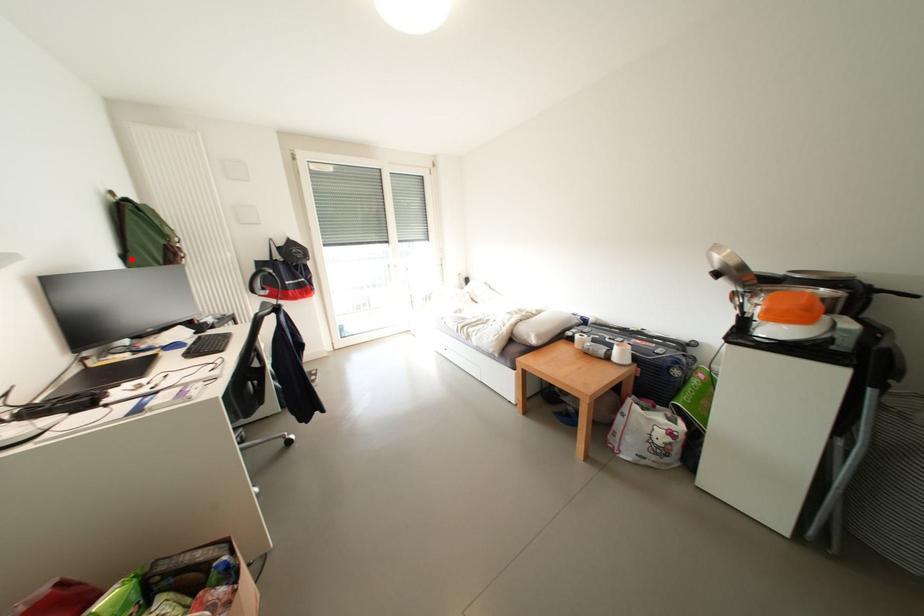
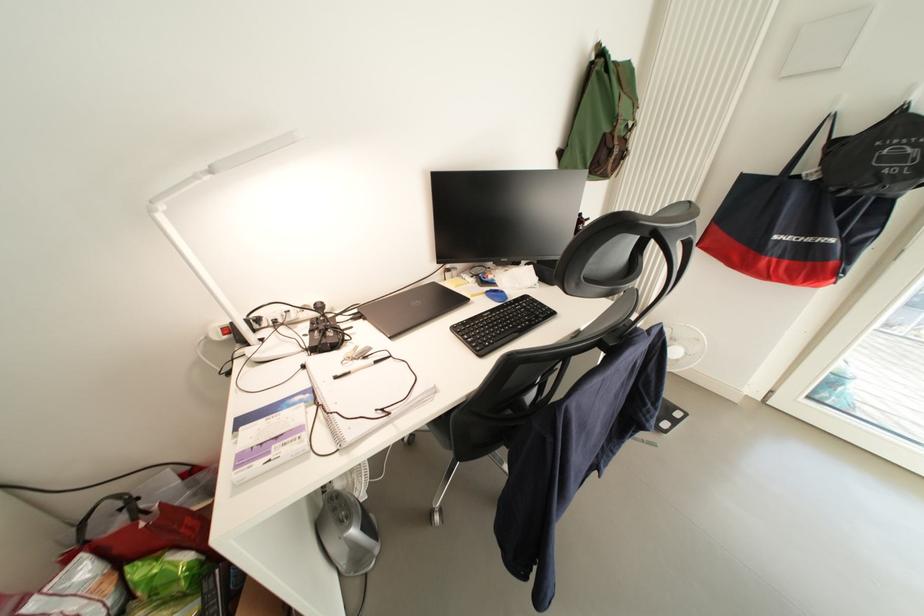
Where in the second image is the point corresponding to the highlighted location from the first image?

(568, 156)